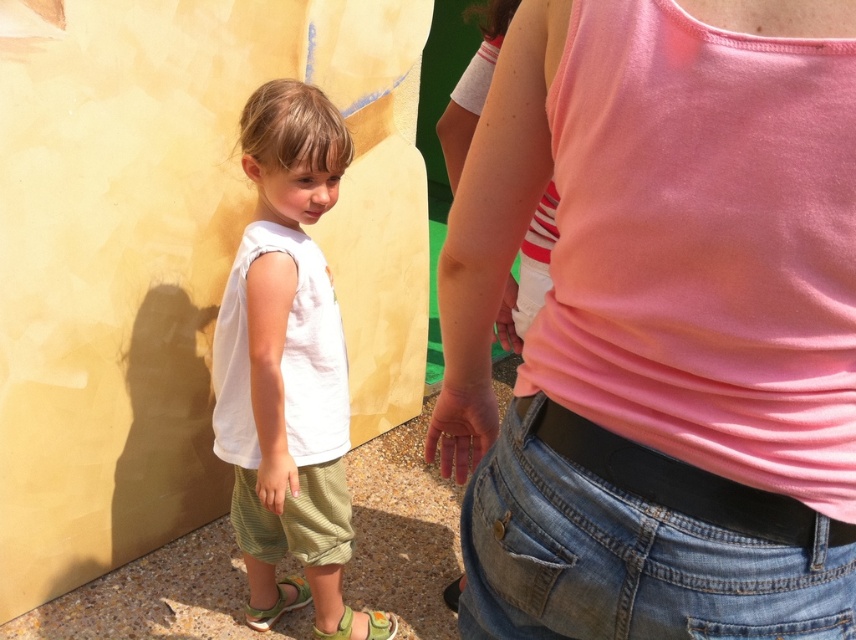
Question: Which point is closer to the camera?

Choices:
 (A) (328, 413)
 (B) (777, 314)

Answer: (B)

Question: Which point is farther to the camera?

Choices:
 (A) [x=310, y=253]
 (B) [x=272, y=621]
 (C) [x=847, y=120]
 (D) [x=314, y=637]

Answer: (B)

Question: Is white cotton shirt at center positioned in front of light green fabric sandal at lower left?

Choices:
 (A) yes
 (B) no

Answer: (A)

Question: Does pink fabric tank top at upper center appear on the left side of white cotton shirt at center?

Choices:
 (A) yes
 (B) no

Answer: (B)

Question: Among these objects, which one is farthest from the camera?

Choices:
 (A) green fabric sandal at lower center
 (B) white cotton shirt at center
 (C) pink fabric tank top at upper center
 (D) light green fabric sandal at lower left

Answer: (D)

Question: Does pink fabric tank top at upper center have a greater width compared to white cotton shirt at center?

Choices:
 (A) no
 (B) yes

Answer: (B)